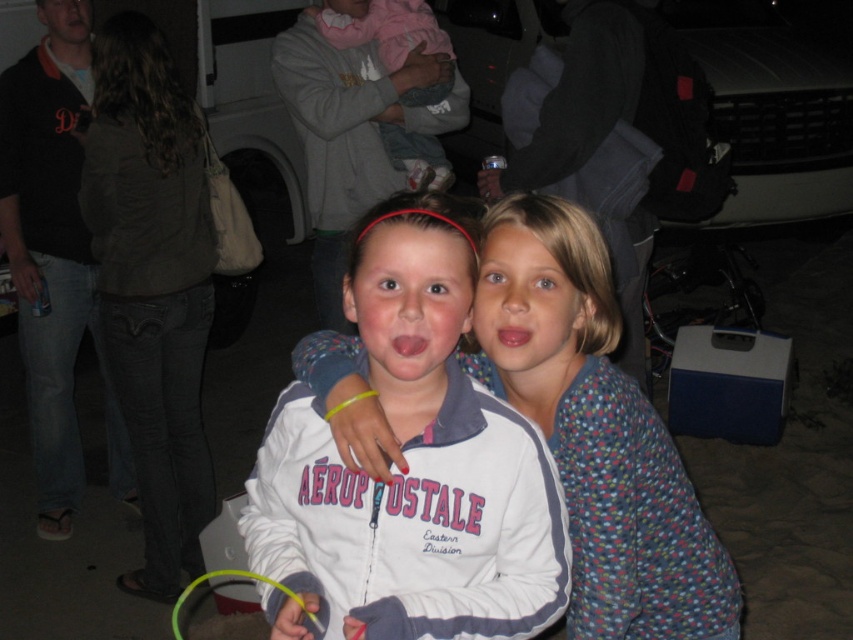
Does pink fabric at center have a larger size compared to pink matte lips at center?

Correct, pink fabric at center is larger in size than pink matte lips at center.

Which of these two, pink fabric at center or pink matte lips at center, stands shorter?

With less height is pink matte lips at center.

This screenshot has width=853, height=640. In order to click on pink fabric at center in this screenshot , I will do `click(347, 6)`.

This screenshot has width=853, height=640. Describe the element at coordinates (65, 20) in the screenshot. I see `smooth skin face at center` at that location.

Does point (62, 26) lie behind point (349, 4)?

Yes, it is.

The width and height of the screenshot is (853, 640). I want to click on smooth skin face at center, so click(65, 20).

Between white fleece jacket at center and pink fabric at center, which one has less height?

pink fabric at center is shorter.

Describe the element at coordinates (410, 467) in the screenshot. I see `white fleece jacket at center` at that location.

At what (x,y) coordinates should I click in order to perform the action: click on white fleece jacket at center. Please return your answer as a coordinate pair (x, y). The width and height of the screenshot is (853, 640). Looking at the image, I should click on (410, 467).